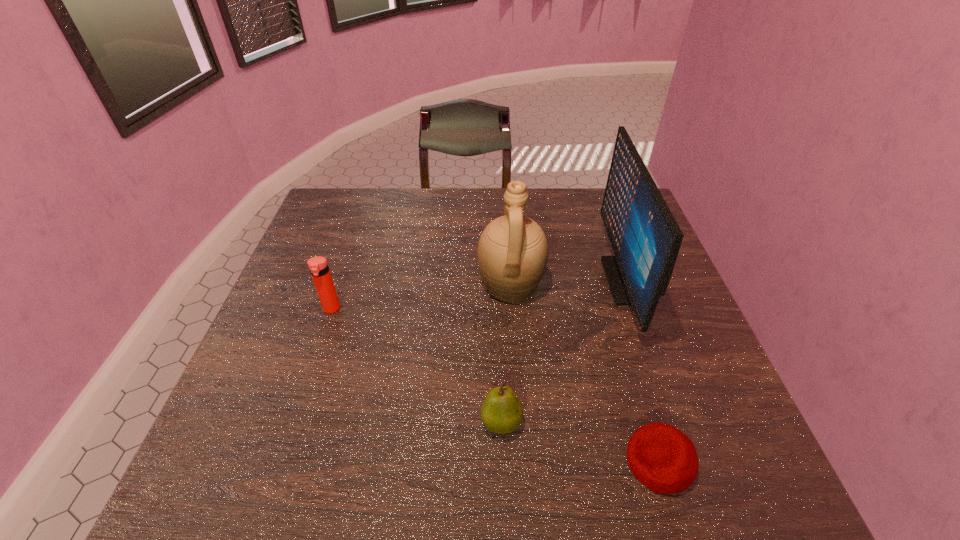
Point out which object is positioned as the nearest to the computer monitor. Please provide its 2D coordinates. Your answer should be formatted as a tuple, i.e. [(x, y)], where the tuple contains the x and y coordinates of a point satisfying the conditions above.

[(512, 252)]

What are the coordinates of `vacant space that satisfies the following two spatial constraints: 1. on the back side of the pitcher; 2. on the right side of the second shortest object` in the screenshot? It's located at (495, 285).